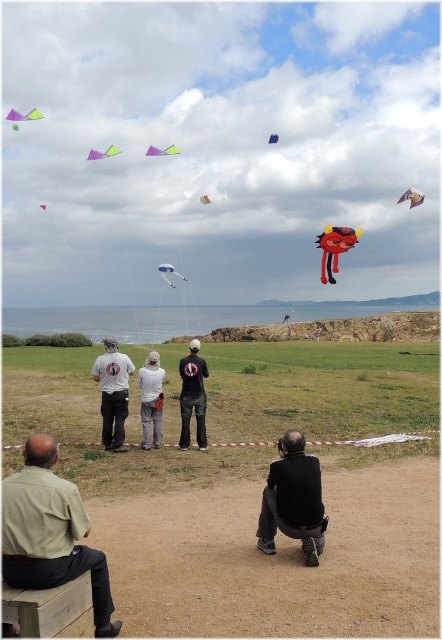
You are standing at the point labeled point (270, 136) and want to walk towards the point labeled point (195, 362). Which direction should you move to get closer to your destination?

To move from point (270, 136) to point (195, 362), you should move towards the lower right direction since point (195, 362) is closer to the viewer than point (270, 136).

In the scene shown: You are a photographer at the event. You want to capture a photo of both the white cotton shirt at center and the matte green kite at center in the same frame. Based on their positions, which one should you focus on first to ensure both are in the frame?

The white cotton shirt at center is located below the matte green kite at center, so you should focus on the matte green kite at center first to ensure both are in the frame.

You are planning to take a photo of the white cotton shirt at center and the matte green kite at center. Based on their sizes in the image, which object would appear smaller in the photo?

The white cotton shirt at center would appear smaller in the photo because it has a lesser width compared to the matte green kite at center.